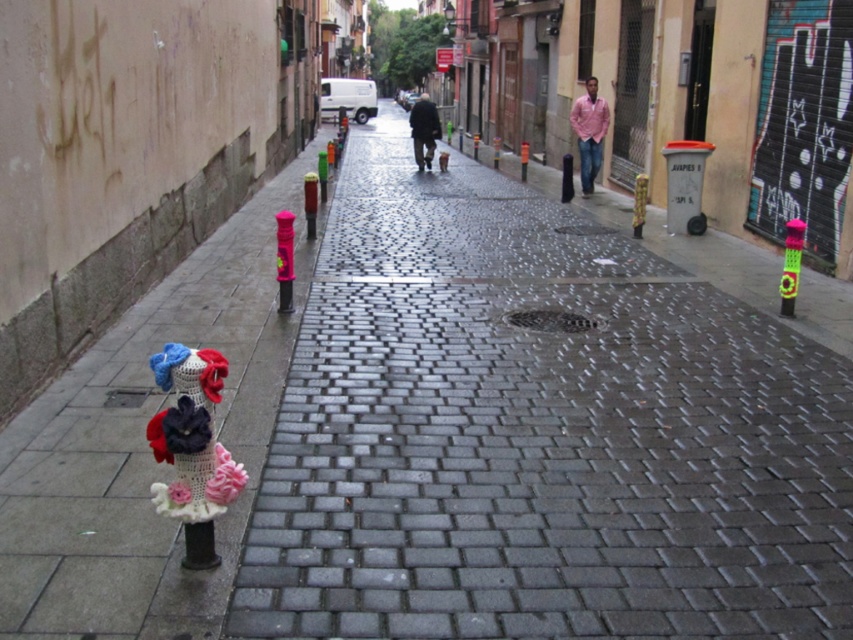
You are a delivery person trying to navigate through the narrow street. You see a pink matte shirt at right and a pink fabric at center. Which object is closer to the right side of the street?

The pink matte shirt at right is closer to the right side of the street as it is positioned to the right of the pink fabric at center.

You are a pedestrian standing on the wet cobblestone pavement in the narrow urban street scene. You notice a point labeled as point [589,131] in the image. Based on the scene description, can you determine what object this point is located on?

The point [589,131] is located on the pink matte shirt at right.

You are a delivery person trying to navigate through the narrow street. You need to pass between the neon green plastic pole at center and the multicolored knitted hydrant at right. Can you fit through the space between them?

The neon green plastic pole at center is much taller than the multicolored knitted hydrant at right, so the space between them may be sufficient for a delivery person to pass through. However, the exact width isn